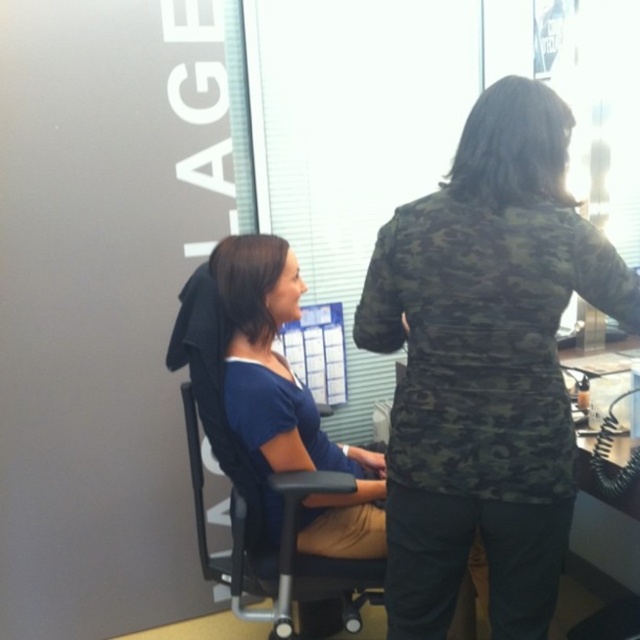
You are a photographer setting up a shot in this office scene. You have two points marked in the image at coordinates point (429, 298) and point (198, 506). Which point should you focus on first if you want to ensure both points are in sharp focus?

Point (429, 298) is closer to the camera than point (198, 506). To ensure both points are in sharp focus, you should focus on the closer point first, which is point (429, 298).